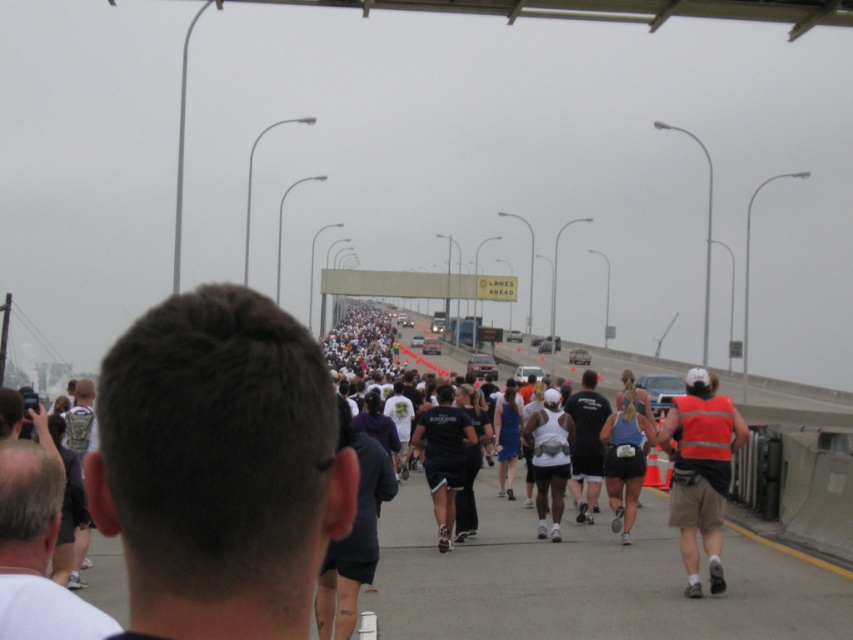
You are standing at the point marked as point (172, 449) in the image. You want to take a photo of the marathon runners using a camera that has a focal length of 50mm. If the camera is positioned 4.47 feet away from the point, will the entire group of runners be visible in the photo?

The camera is positioned 4.47 feet away from point (172, 449), so the entire group of runners will be visible in the photo since the distance is sufficient to capture the entire scene.